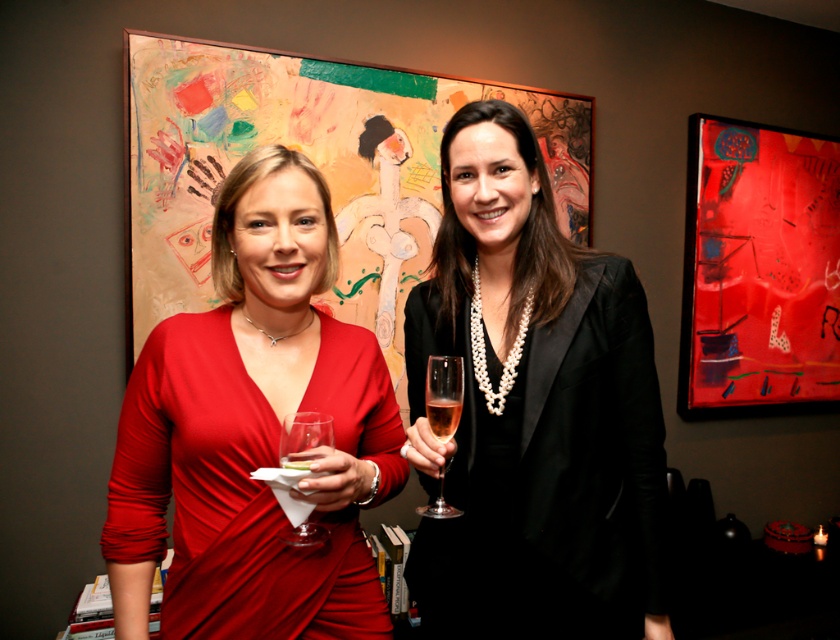
Locate an element on the screen. The height and width of the screenshot is (640, 840). black satin dress at center is located at coordinates (534, 410).

Is the position of black satin dress at center more distant than that of translucent glass at center?

Yes, black satin dress at center is behind translucent glass at center.

At what (x,y) coordinates should I click in order to perform the action: click on black satin dress at center. Please return your answer as a coordinate pair (x, y). This screenshot has height=640, width=840. Looking at the image, I should click on pos(534,410).

The width and height of the screenshot is (840, 640). Find the location of `matte red dress at center`. matte red dress at center is located at coordinates [253, 432].

From the picture: Who is shorter, matte red dress at center or translucent glass at center?

translucent glass at center is shorter.

Is point (366, 369) positioned after point (439, 413)?

Yes, it is behind point (439, 413).

At what (x,y) coordinates should I click in order to perform the action: click on matte red dress at center. Please return your answer as a coordinate pair (x, y). Looking at the image, I should click on (253, 432).

Is point (216, 276) behind point (284, 458)?

Yes.

Between matte red dress at center and clear glass wine glass at lower left, which one appears on the left side from the viewer's perspective?

From the viewer's perspective, matte red dress at center appears more on the left side.

What do you see at coordinates (253, 432) in the screenshot? I see `matte red dress at center` at bounding box center [253, 432].

Find the location of a particular element. matte red dress at center is located at coordinates (253, 432).